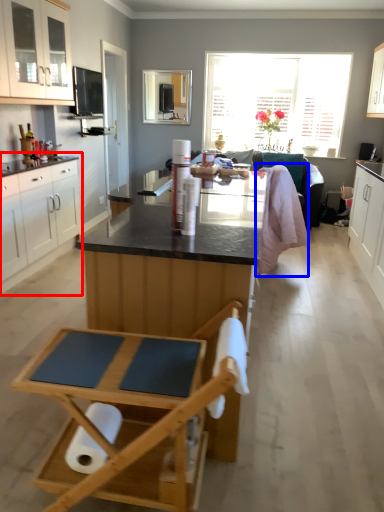
Question: Which object appears farthest to the camera in this image, cabinetry (highlighted by a red box) or blanket (highlighted by a blue box)?

Choices:
 (A) cabinetry
 (B) blanket

Answer: (B)